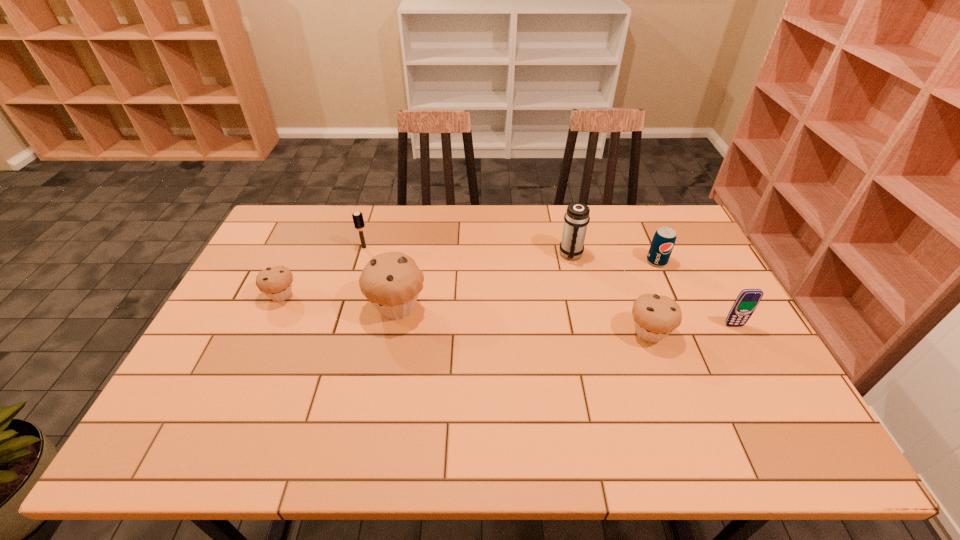
Find the location of a particular element. Image resolution: width=960 pixels, height=540 pixels. free space located 0.290m on the right of the leftmost object is located at coordinates (396, 295).

Locate an element on the screen. vacant space positioned on the front of the second muffin from right to left is located at coordinates (378, 409).

The width and height of the screenshot is (960, 540). Identify the location of vacant space located on the back of the rightmost muffin. (627, 271).

I want to click on free space located on the left of the sixth object from right to left, so click(287, 247).

Where is `vacant space located 0.160m on the side with the handle of the fourth object from left to right`? This screenshot has width=960, height=540. vacant space located 0.160m on the side with the handle of the fourth object from left to right is located at coordinates (582, 300).

The width and height of the screenshot is (960, 540). What are the coordinates of `blank space located on the right of the second object from right to left` in the screenshot? It's located at (685, 261).

Locate an element on the screen. Image resolution: width=960 pixels, height=540 pixels. vacant space situated 0.140m on the front-facing side of the cellular telephone is located at coordinates (758, 369).

This screenshot has width=960, height=540. In order to click on hairbrush present at the far edge in this screenshot , I will do `click(358, 220)`.

You are a GUI agent. You are given a task and a screenshot of the screen. Output one action in this format:
    pyautogui.click(x=<x>, y=<y>)
    Task: Click on the thermos bottle that is at the far edge
    Image resolution: width=960 pixels, height=540 pixels.
    Given the screenshot: What is the action you would take?
    pyautogui.click(x=576, y=218)

Identify the location of object located at the left edge. This screenshot has width=960, height=540. (276, 282).